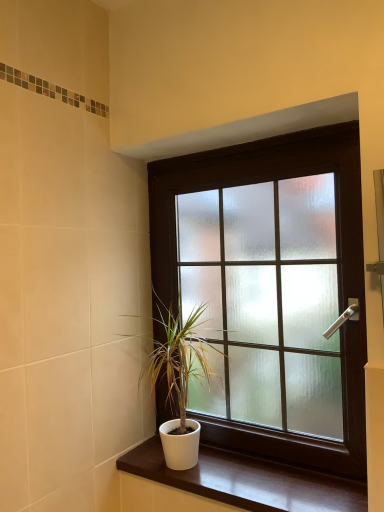
Find the location of `vacant area on top of frosted glass window at center (from a real-world perspective)`. vacant area on top of frosted glass window at center (from a real-world perspective) is located at coordinates (243, 143).